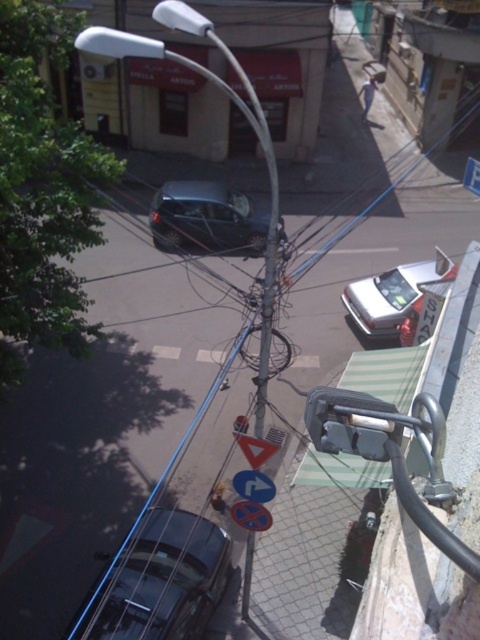
Question: Which object is farther from the camera taking this photo?

Choices:
 (A) metallic reflective arrow at center
 (B) blue glossy traffic sign at lower center
 (C) silver metallic sedan at center

Answer: (C)

Question: Which object is positioned closest to the shiny metallic car at lower left?

Choices:
 (A) metallic reflective arrow at center
 (B) shiny dark gray car at center
 (C) blue glossy traffic sign at lower center
 (D) white glossy lamp post at center

Answer: (D)

Question: Can you confirm if shiny dark gray car at center is bigger than white plastic sign at upper right?

Choices:
 (A) no
 (B) yes

Answer: (B)

Question: Can you confirm if metallic reflective arrow at center is wider than blue glossy traffic sign at lower center?

Choices:
 (A) no
 (B) yes

Answer: (A)

Question: Which is nearer to the red plastic triangle at center?

Choices:
 (A) white glossy lamp post at center
 (B) white plastic sign at upper right

Answer: (A)

Question: Can you confirm if shiny dark gray car at center is wider than blue glossy traffic sign at lower center?

Choices:
 (A) yes
 (B) no

Answer: (A)